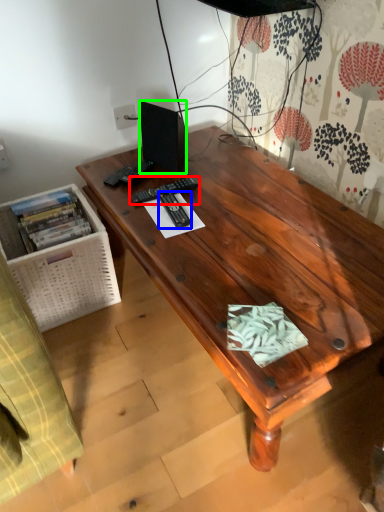
Question: Estimate the real-world distances between objects in this image. Which object is closer to remote control (highlighted by a red box), remote control (highlighted by a blue box) or loudspeaker (highlighted by a green box)?

Choices:
 (A) remote control
 (B) loudspeaker

Answer: (A)